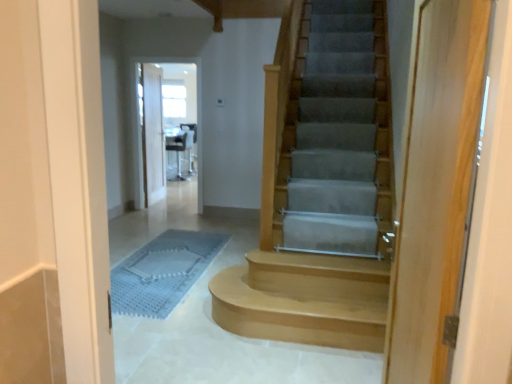
What are the coordinates of `free region under blue textured bath mat at lower center (from a real-world perspective)` in the screenshot? It's located at (158, 270).